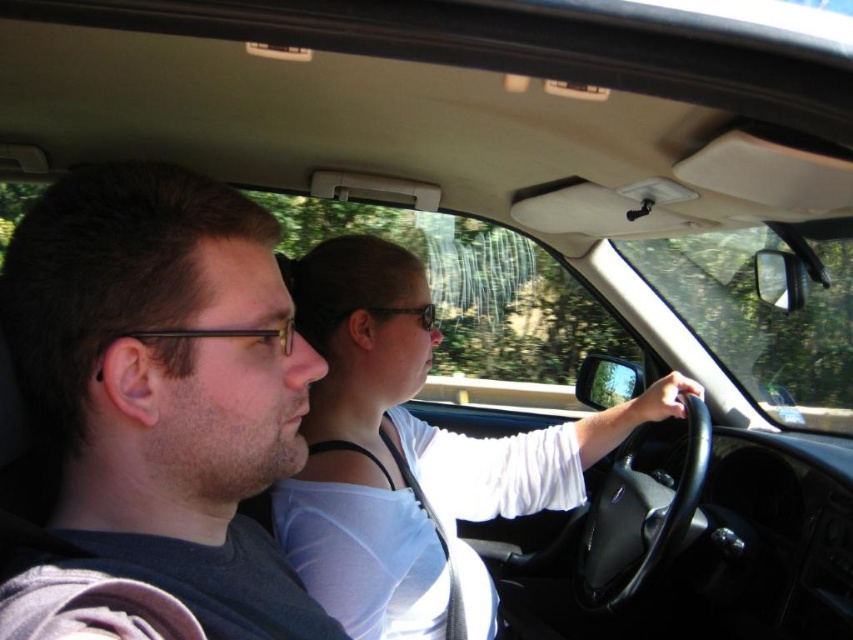
You are sitting in the back seat of the car and want to hand a document to the passenger. Which of the two shirts, the dark gray fabric shirt at left or the matte black shirt at center, is closer to you?

The dark gray fabric shirt at left is closer to you because it is located above the matte black shirt at center, meaning it is nearer in the seating arrangement.

From the picture: You are sitting in the back seat of the car and want to hand a document to the person wearing the dark gray fabric shirt at left and the matte black shirt at center. Which person is closer to you?

The dark gray fabric shirt at left is smaller than matte black shirt at center, so the matte black shirt at center is closer to you.

You are sitting in the back seat of the car and want to hand a document to the person wearing the dark gray fabric shirt at left and the matte black shirt at center. Which person should you hand it to first based on their proximity to you?

You should hand the document to the dark gray fabric shirt at left first because it is closer to you than the matte black shirt at center.